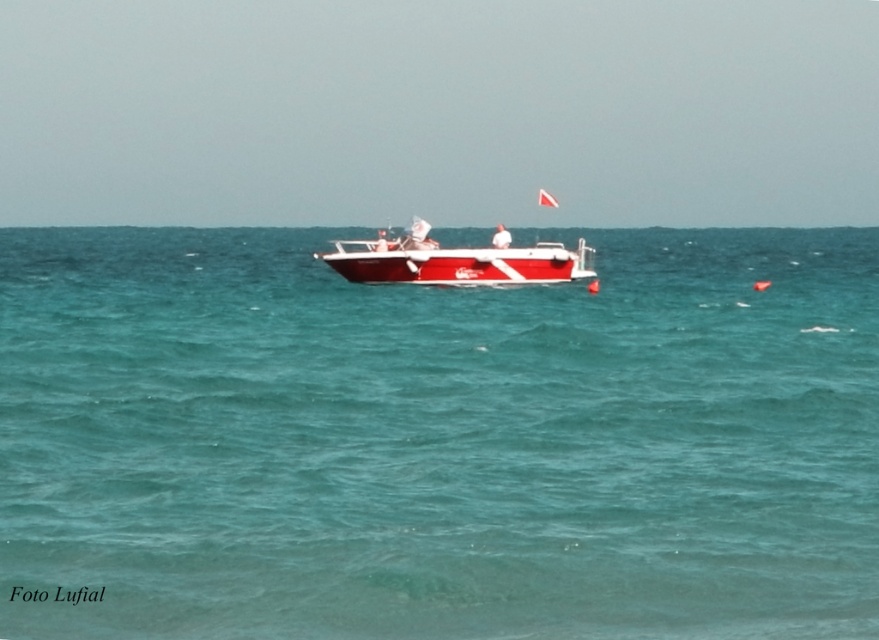
Question: Which object appears closest to the camera in this image?

Choices:
 (A) teal glossy water at center
 (B) shiny red boat at center

Answer: (A)

Question: Is teal glossy water at center above shiny red boat at center?

Choices:
 (A) yes
 (B) no

Answer: (B)

Question: Where is teal glossy water at center located in relation to shiny red boat at center in the image?

Choices:
 (A) above
 (B) below

Answer: (B)

Question: Does teal glossy water at center come behind shiny red boat at center?

Choices:
 (A) yes
 (B) no

Answer: (B)